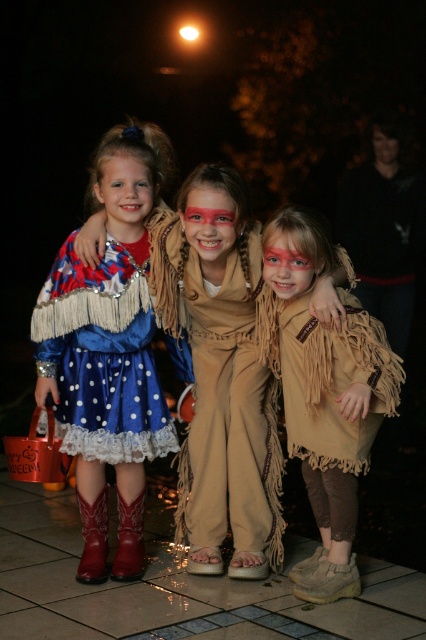
Question: Which point appears closest to the camera in this image?

Choices:
 (A) (209, 493)
 (B) (114, 326)

Answer: (B)

Question: Which point is closer to the camera?

Choices:
 (A) (146, 200)
 (B) (374, 145)
 (C) (109, 234)
 (D) (281, 250)

Answer: (D)

Question: Can you confirm if matte blue dress at left is bigger than red leather boot at lower left?

Choices:
 (A) yes
 (B) no

Answer: (A)

Question: Which point is farther to the camera?

Choices:
 (A) (97, 538)
 (B) (354, 305)

Answer: (A)

Question: Is matte blue dress at left to the right of matte tan face at center from the viewer's perspective?

Choices:
 (A) yes
 (B) no

Answer: (B)

Question: Can you confirm if tan suede jumpsuit at center is positioned below matte blue dress at center?

Choices:
 (A) no
 (B) yes

Answer: (B)